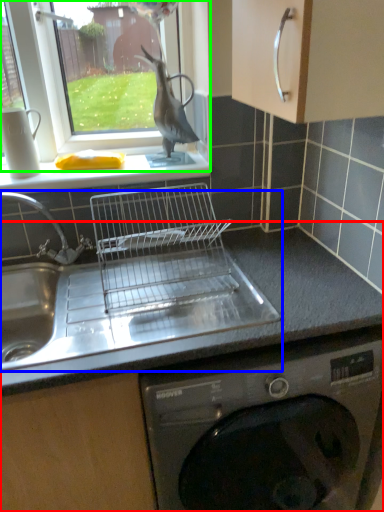
Question: Which object is the closest to the countertop (highlighted by a red box)? Choose among these: sink (highlighted by a blue box) or window (highlighted by a green box).

Choices:
 (A) sink
 (B) window

Answer: (A)